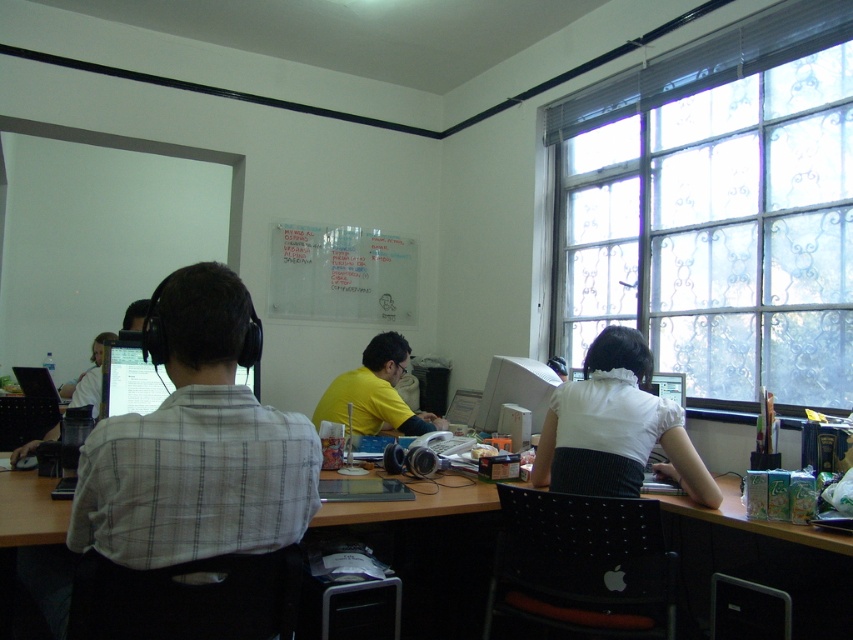
Between white checkered shirt at left and white glossy monitor at center, which one has more height?

white checkered shirt at left is taller.

Is white checkered shirt at left shorter than white glossy monitor at center?

In fact, white checkered shirt at left may be taller than white glossy monitor at center.

Who is more forward, (198,280) or (544,401)?

Point (198,280)

The height and width of the screenshot is (640, 853). Identify the location of white checkered shirt at left. (196, 444).

Where is `white checkered shirt at left`? This screenshot has width=853, height=640. white checkered shirt at left is located at coordinates (196, 444).

Does point (109, 541) come closer to viewer compared to point (370, 422)?

Yes, it is in front of point (370, 422).

Locate an element on the screen. This screenshot has width=853, height=640. white checkered shirt at left is located at coordinates (196, 444).

This screenshot has height=640, width=853. What do you see at coordinates (618, 422) in the screenshot? I see `white fabric shirt at center` at bounding box center [618, 422].

In order to click on white fabric shirt at center in this screenshot , I will do `click(618, 422)`.